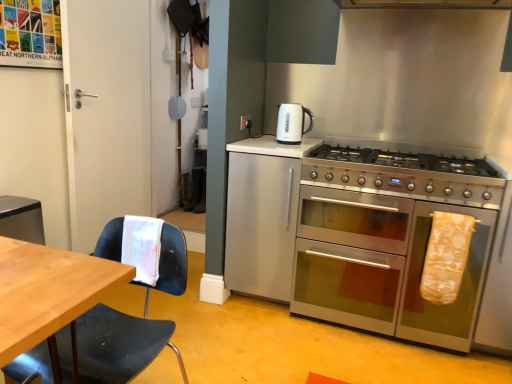
Question: From a real-world perspective, relative to stainless steel gas stove at right, is white glossy electric kettle at upper center vertically above or below?

Choices:
 (A) below
 (B) above

Answer: (B)

Question: Based on their positions, is white glossy electric kettle at upper center located to the left or right of stainless steel gas stove at right?

Choices:
 (A) right
 (B) left

Answer: (B)

Question: Which object is positioned farthest from the black plastic chair at left?

Choices:
 (A) stainless steel gas stove at right
 (B) white paper towel at left, the 1th material viewed from the front
 (C) white glossy electric kettle at upper center
 (D) stainless steel oven at right
 (E) white matte door at left

Answer: (E)

Question: Based on their relative distances, which object is farther from the satin silver cabinet at center?

Choices:
 (A) yellow fabric oven mitt at right, the first material viewed from the right
 (B) white matte door at left
 (C) white paper towel at left, the 1th material viewed from the front
 (D) black plastic chair at left
 (E) stainless steel gas stove at right

Answer: (B)